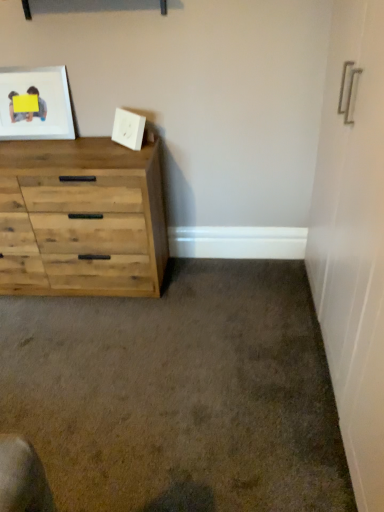
This screenshot has width=384, height=512. What do you see at coordinates (81, 218) in the screenshot?
I see `natural wood chest of drawers at left` at bounding box center [81, 218].

The image size is (384, 512). In order to click on natural wood chest of drawers at left in this screenshot , I will do `click(81, 218)`.

At what (x,y) coordinates should I click in order to perform the action: click on white matte picture frame at upper center, which ranks as the 2th picture frame in left-to-right order. Please return your answer as a coordinate pair (x, y). Looking at the image, I should click on (128, 129).

Considering the sizes of objects matte wooden picture frame at upper left, arranged as the first picture frame when viewed from the left, and natural wood chest of drawers at left in the image provided, who is shorter, matte wooden picture frame at upper left, arranged as the first picture frame when viewed from the left, or natural wood chest of drawers at left?

With less height is matte wooden picture frame at upper left, arranged as the first picture frame when viewed from the left.

Can you see matte wooden picture frame at upper left, arranged as the first picture frame when viewed from the left, touching natural wood chest of drawers at left?

No, matte wooden picture frame at upper left, arranged as the first picture frame when viewed from the left, is not next to natural wood chest of drawers at left.

Which object is further away from the camera taking this photo, matte wooden picture frame at upper left, arranged as the first picture frame when viewed from the left, or natural wood chest of drawers at left?

matte wooden picture frame at upper left, arranged as the first picture frame when viewed from the left, is further away from the camera.

Between white matte picture frame at upper center, which ranks as the 2th picture frame in left-to-right order, and matte wooden picture frame at upper left, marked as the 2th picture frame in a right-to-left arrangement, which one has smaller width?

Thinner between the two is matte wooden picture frame at upper left, marked as the 2th picture frame in a right-to-left arrangement.

Based on the photo, could you measure the distance between white matte picture frame at upper center, which is counted as the 1th picture frame, starting from the right, and matte wooden picture frame at upper left, arranged as the first picture frame when viewed from the left?

white matte picture frame at upper center, which is counted as the 1th picture frame, starting from the right, is 16.24 inches from matte wooden picture frame at upper left, arranged as the first picture frame when viewed from the left.

Is point (123, 114) farther from camera compared to point (30, 128)?

No, (123, 114) is in front of (30, 128).

Between white matte picture frame at upper center, which is counted as the 1th picture frame, starting from the right, and matte wooden picture frame at upper left, arranged as the first picture frame when viewed from the left, which one appears on the right side from the viewer's perspective?

Positioned to the right is white matte picture frame at upper center, which is counted as the 1th picture frame, starting from the right.

Where is `the chest of drawers lying in front of the white matte picture frame at upper center, which is counted as the 1th picture frame, starting from the right`? The image size is (384, 512). the chest of drawers lying in front of the white matte picture frame at upper center, which is counted as the 1th picture frame, starting from the right is located at coordinates (81, 218).

Is natural wood chest of drawers at left looking in the opposite direction of white matte picture frame at upper center, which ranks as the 2th picture frame in left-to-right order?

natural wood chest of drawers at left does not have its back to white matte picture frame at upper center, which ranks as the 2th picture frame in left-to-right order.

Which is more to the left, natural wood chest of drawers at left or white matte picture frame at upper center, which ranks as the 2th picture frame in left-to-right order?

Positioned to the left is natural wood chest of drawers at left.

Is natural wood chest of drawers at left touching white matte picture frame at upper center, which ranks as the 2th picture frame in left-to-right order?

natural wood chest of drawers at left and white matte picture frame at upper center, which ranks as the 2th picture frame in left-to-right order, are clearly separated.

Considering the sizes of objects matte wooden picture frame at upper left, marked as the 2th picture frame in a right-to-left arrangement, and white matte picture frame at upper center, which is counted as the 1th picture frame, starting from the right, in the image provided, who is shorter, matte wooden picture frame at upper left, marked as the 2th picture frame in a right-to-left arrangement, or white matte picture frame at upper center, which is counted as the 1th picture frame, starting from the right,?

white matte picture frame at upper center, which is counted as the 1th picture frame, starting from the right.

From the image's perspective, who appears lower, matte wooden picture frame at upper left, arranged as the first picture frame when viewed from the left, or white matte picture frame at upper center, which ranks as the 2th picture frame in left-to-right order?

white matte picture frame at upper center, which ranks as the 2th picture frame in left-to-right order, appears lower in the image.

How different are the orientations of matte wooden picture frame at upper left, arranged as the first picture frame when viewed from the left, and white matte picture frame at upper center, which ranks as the 2th picture frame in left-to-right order, in degrees?

There is a 45-degree angle between the facing directions of matte wooden picture frame at upper left, arranged as the first picture frame when viewed from the left, and white matte picture frame at upper center, which ranks as the 2th picture frame in left-to-right order.

Considering the relative sizes of matte wooden picture frame at upper left, arranged as the first picture frame when viewed from the left, and white matte picture frame at upper center, which ranks as the 2th picture frame in left-to-right order, in the image provided, is matte wooden picture frame at upper left, arranged as the first picture frame when viewed from the left, smaller than white matte picture frame at upper center, which ranks as the 2th picture frame in left-to-right order,?

Actually, matte wooden picture frame at upper left, arranged as the first picture frame when viewed from the left, might be larger than white matte picture frame at upper center, which ranks as the 2th picture frame in left-to-right order.

Does white matte picture frame at upper center, which is counted as the 1th picture frame, starting from the right, have a smaller size compared to natural wood chest of drawers at left?

Indeed, white matte picture frame at upper center, which is counted as the 1th picture frame, starting from the right, has a smaller size compared to natural wood chest of drawers at left.

Is point (140, 126) positioned behind point (132, 250)?

No, (140, 126) is closer to viewer.

Is white matte picture frame at upper center, which is counted as the 1th picture frame, starting from the right, positioned in front of natural wood chest of drawers at left?

That is False.

Which is more to the left, white matte picture frame at upper center, which is counted as the 1th picture frame, starting from the right, or natural wood chest of drawers at left?

natural wood chest of drawers at left is more to the left.

Is natural wood chest of drawers at left thinner than matte wooden picture frame at upper left, marked as the 2th picture frame in a right-to-left arrangement?

In fact, natural wood chest of drawers at left might be wider than matte wooden picture frame at upper left, marked as the 2th picture frame in a right-to-left arrangement.

Is natural wood chest of drawers at left not near matte wooden picture frame at upper left, arranged as the first picture frame when viewed from the left?

No.

From a real-world perspective, between natural wood chest of drawers at left and matte wooden picture frame at upper left, marked as the 2th picture frame in a right-to-left arrangement, who is vertically higher?

matte wooden picture frame at upper left, marked as the 2th picture frame in a right-to-left arrangement, from a real-world perspective.

Considering the sizes of objects natural wood chest of drawers at left and matte wooden picture frame at upper left, marked as the 2th picture frame in a right-to-left arrangement, in the image provided, who is shorter, natural wood chest of drawers at left or matte wooden picture frame at upper left, marked as the 2th picture frame in a right-to-left arrangement,?

matte wooden picture frame at upper left, marked as the 2th picture frame in a right-to-left arrangement.

From a real-world perspective, starting from the natural wood chest of drawers at left, which picture frame is the 2nd one vertically above it? Please provide its 2D coordinates.

[(38, 102)]

Identify the location of picture frame lying on the right of matte wooden picture frame at upper left, marked as the 2th picture frame in a right-to-left arrangement. (128, 129).

Which object lies further to the anchor point natural wood chest of drawers at left, matte wooden picture frame at upper left, arranged as the first picture frame when viewed from the left, or white matte picture frame at upper center, which ranks as the 2th picture frame in left-to-right order?

Based on the image, white matte picture frame at upper center, which ranks as the 2th picture frame in left-to-right order, appears to be further to natural wood chest of drawers at left.

Looking at the image, which one is located closer to white matte picture frame at upper center, which ranks as the 2th picture frame in left-to-right order, natural wood chest of drawers at left or matte wooden picture frame at upper left, marked as the 2th picture frame in a right-to-left arrangement?

Based on the image, matte wooden picture frame at upper left, marked as the 2th picture frame in a right-to-left arrangement, appears to be nearer to white matte picture frame at upper center, which ranks as the 2th picture frame in left-to-right order.

Looking at the image, which one is located closer to matte wooden picture frame at upper left, marked as the 2th picture frame in a right-to-left arrangement, natural wood chest of drawers at left or white matte picture frame at upper center, which ranks as the 2th picture frame in left-to-right order?

natural wood chest of drawers at left lies closer to matte wooden picture frame at upper left, marked as the 2th picture frame in a right-to-left arrangement, than the other object.

Based on their spatial positions, is white matte picture frame at upper center, which is counted as the 1th picture frame, starting from the right, or matte wooden picture frame at upper left, arranged as the first picture frame when viewed from the left, closer to natural wood chest of drawers at left?

Based on the image, matte wooden picture frame at upper left, arranged as the first picture frame when viewed from the left, appears to be nearer to natural wood chest of drawers at left.

Looking at the image, which one is located closer to matte wooden picture frame at upper left, marked as the 2th picture frame in a right-to-left arrangement, white matte picture frame at upper center, which ranks as the 2th picture frame in left-to-right order, or natural wood chest of drawers at left?

Among the two, natural wood chest of drawers at left is located nearer to matte wooden picture frame at upper left, marked as the 2th picture frame in a right-to-left arrangement.

When comparing their distances from white matte picture frame at upper center, which is counted as the 1th picture frame, starting from the right, does matte wooden picture frame at upper left, marked as the 2th picture frame in a right-to-left arrangement, or natural wood chest of drawers at left seem further?

Based on the image, natural wood chest of drawers at left appears to be further to white matte picture frame at upper center, which is counted as the 1th picture frame, starting from the right.

Identify the location of picture frame between matte wooden picture frame at upper left, arranged as the first picture frame when viewed from the left, and natural wood chest of drawers at left from top to bottom. The width and height of the screenshot is (384, 512). (128, 129).